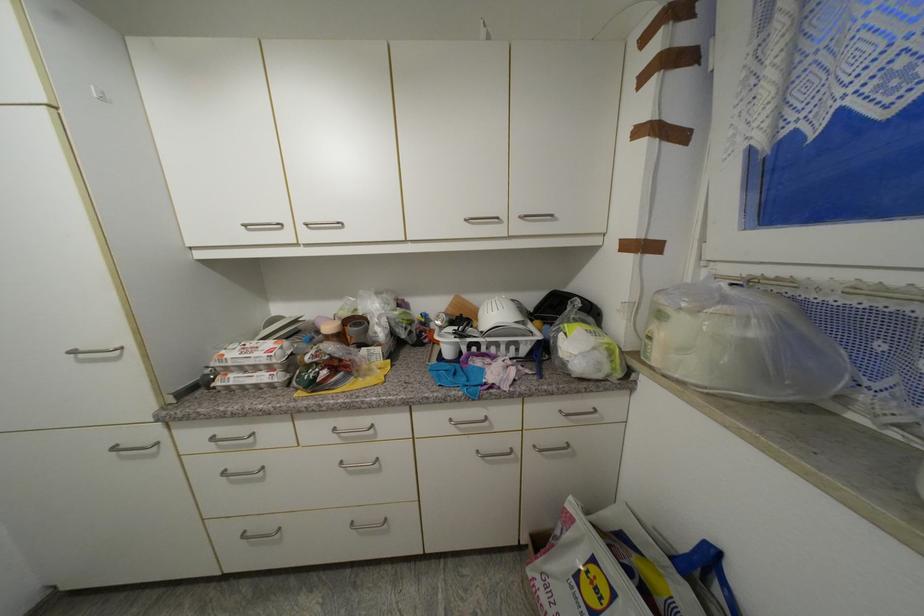
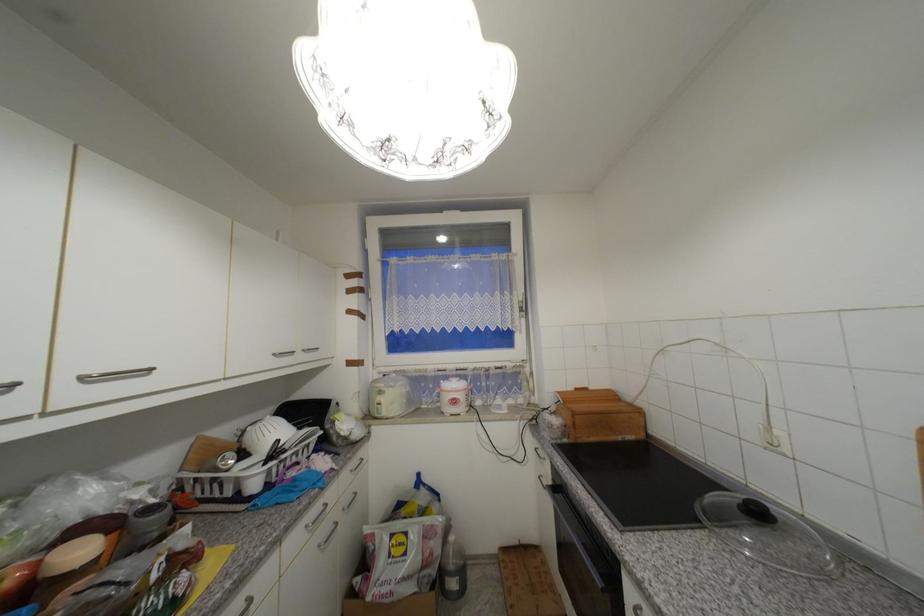
Where in the second image is the point corresponding to pixel 470 222 from the first image?

(281, 355)